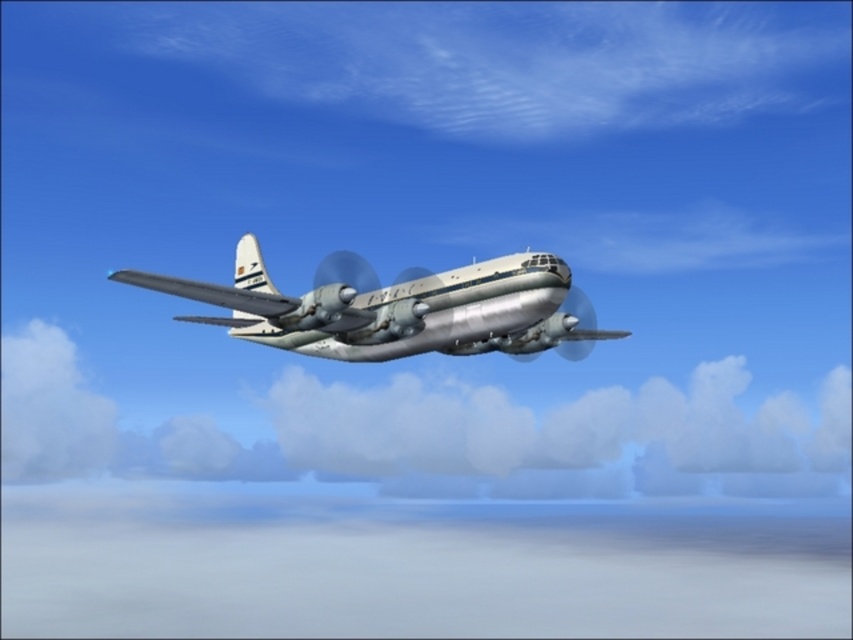
Which of these two, white fluffy cloud at center or silver metallic airplane at center, stands taller?

white fluffy cloud at center is taller.

Does point (13, 376) lie in front of point (262, 320)?

No, it is behind (262, 320).

Between point (701, 378) and point (428, 275), which one is positioned behind?

The point (701, 378) is more distant.

Find the location of `white fluffy cloud at center`. white fluffy cloud at center is located at coordinates (436, 433).